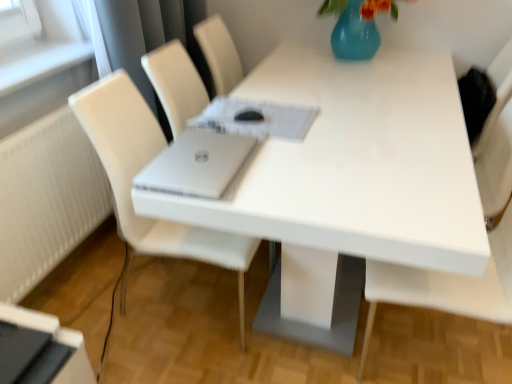
Where is `vacant space positioned to the left of white leather chair at center, the first chair in the left-to-right sequence`? The image size is (512, 384). vacant space positioned to the left of white leather chair at center, the first chair in the left-to-right sequence is located at coordinates (94, 306).